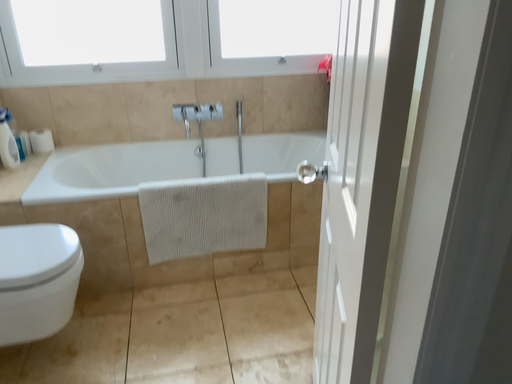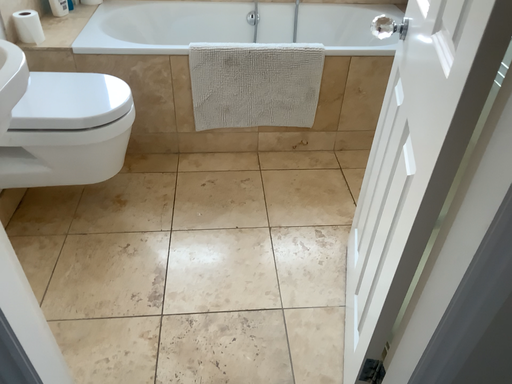
Question: How did the camera likely rotate when shooting the video?

Choices:
 (A) rotated downward
 (B) rotated upward

Answer: (A)